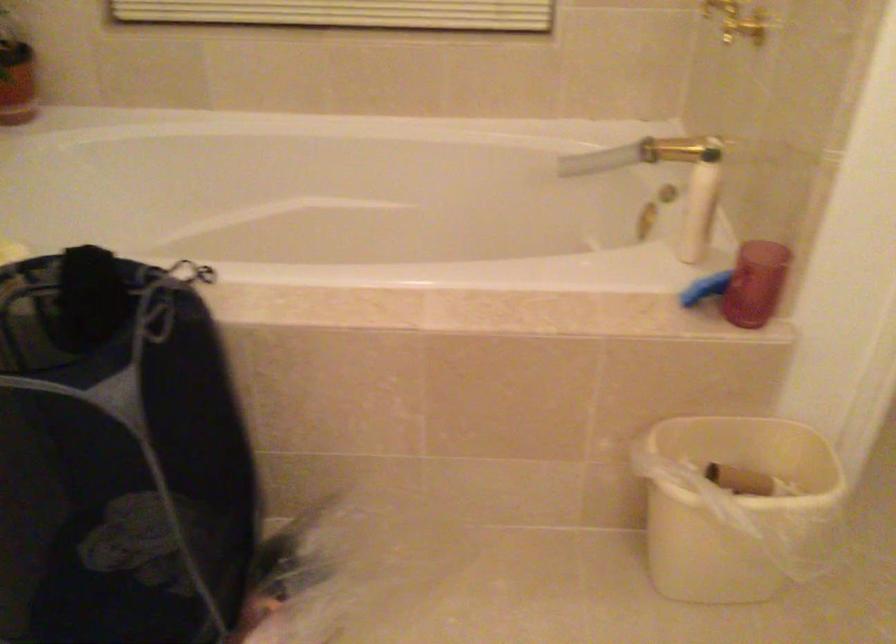
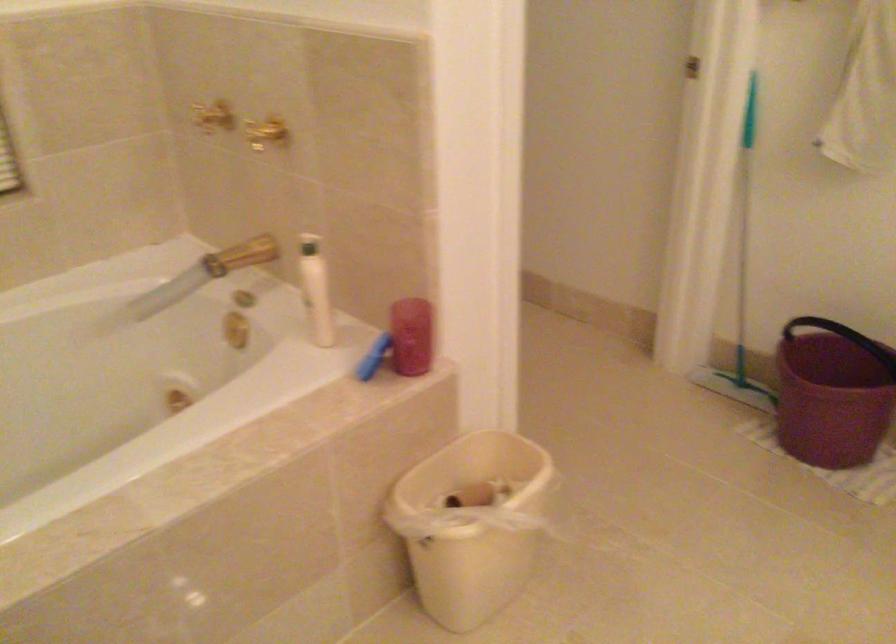
Locate, in the second image, the point that corresponds to [672,146] in the first image.

(240, 254)